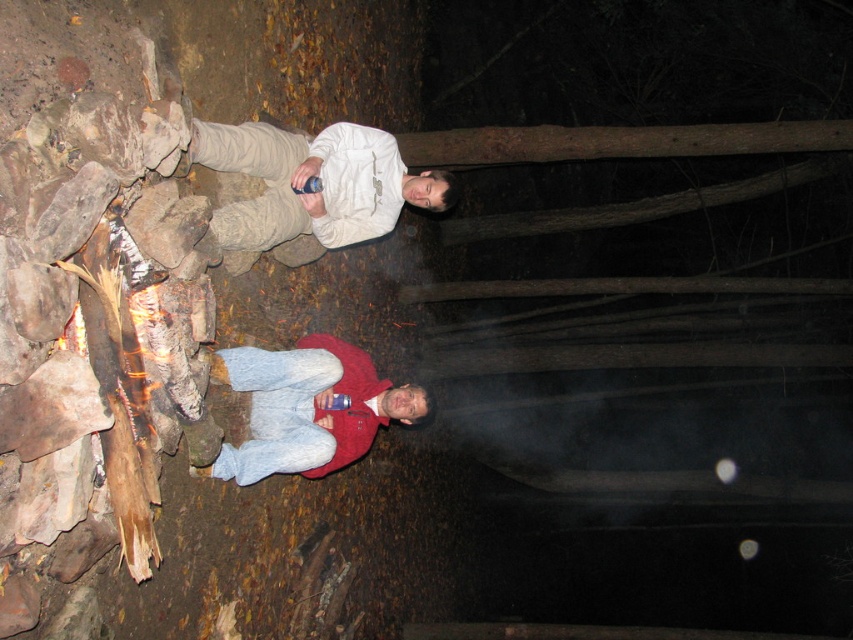
You are a photographer trying to capture the scene of the campfire. You notice the white matte shirt at upper center and the red fleece jacket at center. Which clothing item would appear bigger in your photo?

The white matte shirt at upper center appears bigger in the photo because it has a larger size compared to the red fleece jacket at center.

You are standing in the woods and see the white matte shirt at upper center and the red fleece jacket at center. Which one is positioned more to the left side?

The white matte shirt at upper center is positioned to the left of the red fleece jacket at center, so the white matte shirt at upper center is more to the left side.